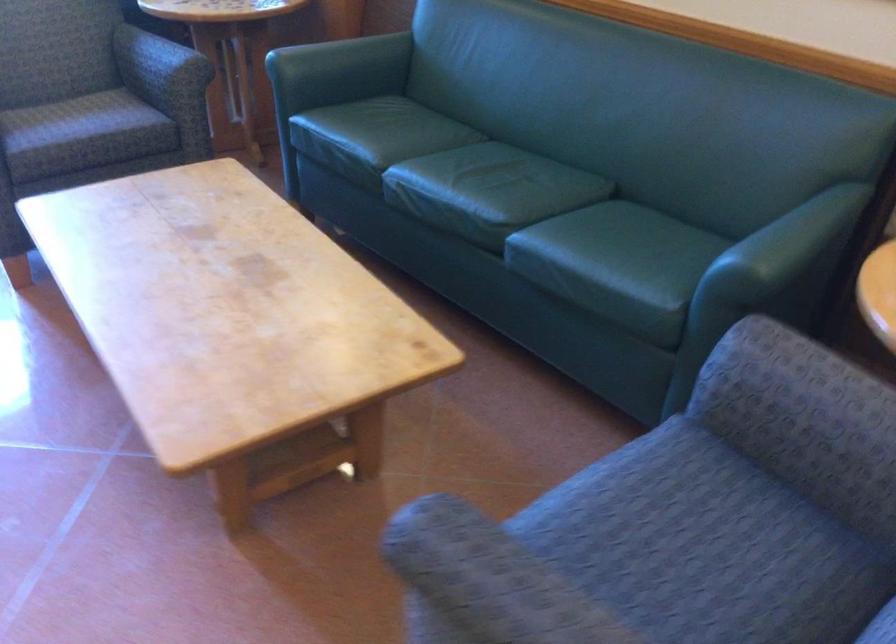
The image size is (896, 644). What do you see at coordinates (791, 238) in the screenshot?
I see `the green sofa armrest` at bounding box center [791, 238].